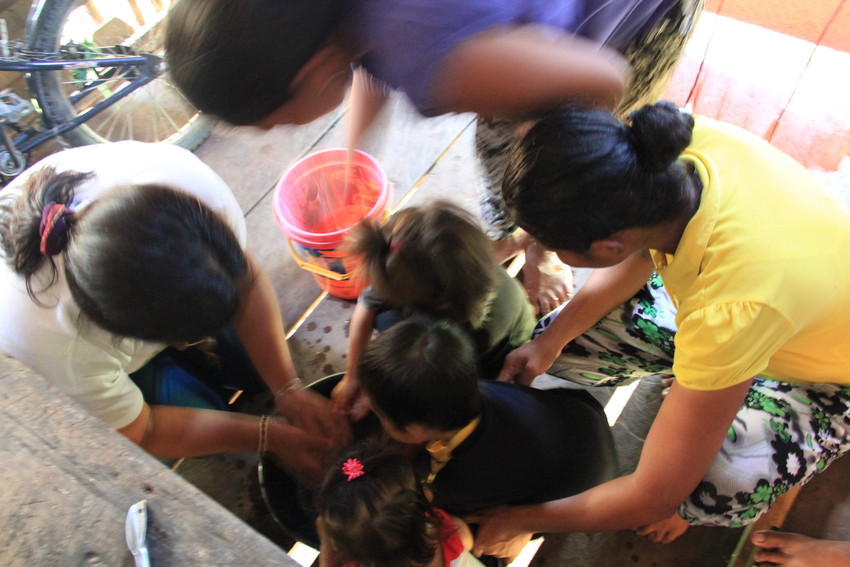
I want to click on bucket, so click(x=326, y=217).